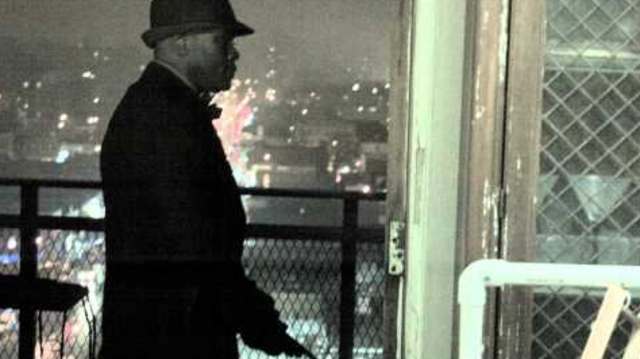
Locate an element on the screen. This screenshot has height=359, width=640. door jamb is located at coordinates (427, 198).